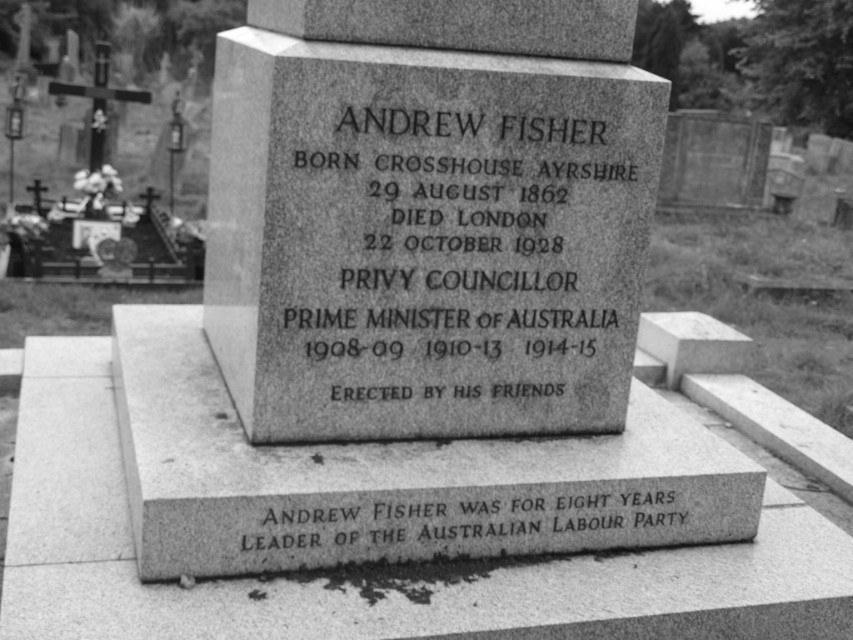
You are a historian examining the gravestone of Andrew Fisher. You notice two elements on the stone. The first is the granite plaque at center, and the second is the black granite text at lower center. Based on their dimensions, which of these two features is narrower?

The granite plaque at center is thinner than the black granite text at lower center, so the granite plaque at center is narrower.

You are standing in front of the gravestone and notice two points marked on it. The first point is at coordinates point [431,339] and the second is at point [445,499]. Which of these points is closer to you?

Point [431,339] is closer to you because it is further to the viewer than point [445,499].

Looking at the gravestone, where is the granite plaque at center in relation to the black granite text at lower center?

The granite plaque at center is to the left of the black granite text at lower center.